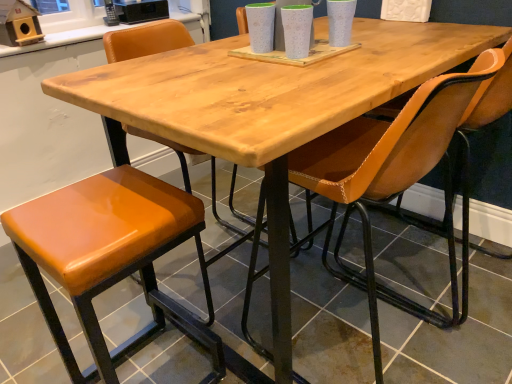
Question: Is leatherette chair at center, which is counted as the 1th chair, starting from the bottom, positioned with its back to orange leather chair at center, which is counted as the 2th chair, starting from the front?

Choices:
 (A) yes
 (B) no

Answer: (B)

Question: Considering the relative sizes of leatherette chair at center, which is counted as the 1th chair, starting from the bottom, and orange leather chair at center, positioned as the first chair in top-to-bottom order, in the image provided, is leatherette chair at center, which is counted as the 1th chair, starting from the bottom, bigger than orange leather chair at center, positioned as the first chair in top-to-bottom order,?

Choices:
 (A) no
 (B) yes

Answer: (B)

Question: Is leatherette chair at center, which is counted as the 1th chair, starting from the bottom, directly adjacent to orange leather chair at center, acting as the second chair starting from the bottom?

Choices:
 (A) no
 (B) yes

Answer: (A)

Question: Is leatherette chair at center, which is counted as the 1th chair, starting from the bottom, at the right side of orange leather chair at center, positioned as the first chair in top-to-bottom order?

Choices:
 (A) yes
 (B) no

Answer: (A)

Question: Would you consider leatherette chair at center, which ranks as the first chair in front-to-back order, to be distant from orange leather chair at center, acting as the second chair starting from the bottom?

Choices:
 (A) no
 (B) yes

Answer: (A)

Question: Is leatherette chair at center, which is the 2th chair in back-to-front order, surrounding orange leather chair at center, which is counted as the 2th chair, starting from the front?

Choices:
 (A) yes
 (B) no

Answer: (B)

Question: Can you confirm if leatherette chair at center, which is counted as the 1th chair, starting from the bottom, is taller than orange leather stool at lower left?

Choices:
 (A) yes
 (B) no

Answer: (A)

Question: Is leatherette chair at center, the 2th chair positioned from the top, beside orange leather stool at lower left?

Choices:
 (A) yes
 (B) no

Answer: (B)

Question: From a real-world perspective, is leatherette chair at center, the 2th chair positioned from the top, beneath orange leather stool at lower left?

Choices:
 (A) yes
 (B) no

Answer: (B)

Question: Is leatherette chair at center, which ranks as the first chair in front-to-back order, oriented away from orange leather stool at lower left?

Choices:
 (A) yes
 (B) no

Answer: (B)

Question: Considering the relative sizes of leatherette chair at center, the 2th chair positioned from the top, and orange leather stool at lower left in the image provided, is leatherette chair at center, the 2th chair positioned from the top, bigger than orange leather stool at lower left?

Choices:
 (A) no
 (B) yes

Answer: (B)

Question: Is leatherette chair at center, which is the 2th chair in back-to-front order, facing towards orange leather stool at lower left?

Choices:
 (A) no
 (B) yes

Answer: (A)

Question: From the image's perspective, is orange leather chair at center, which is counted as the 2th chair, starting from the front, over leatherette chair at center, which is counted as the 1th chair, starting from the bottom?

Choices:
 (A) yes
 (B) no

Answer: (A)